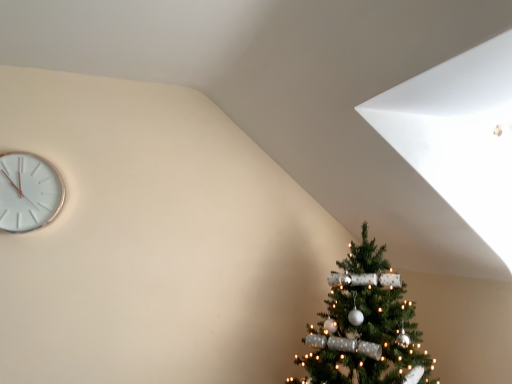
Question: Could you tell me if white metallic clock at upper left is turned towards green textured christmas tree at lower right?

Choices:
 (A) no
 (B) yes

Answer: (A)

Question: From the image's perspective, is white metallic clock at upper left under green textured christmas tree at lower right?

Choices:
 (A) yes
 (B) no

Answer: (B)

Question: Can you confirm if white metallic clock at upper left is positioned to the left of green textured christmas tree at lower right?

Choices:
 (A) no
 (B) yes

Answer: (B)

Question: Is white metallic clock at upper left beside green textured christmas tree at lower right?

Choices:
 (A) yes
 (B) no

Answer: (B)

Question: Is white metallic clock at upper left completely or partially outside of green textured christmas tree at lower right?

Choices:
 (A) no
 (B) yes

Answer: (B)

Question: Would you say white metallic clock at upper left contains green textured christmas tree at lower right?

Choices:
 (A) yes
 (B) no

Answer: (B)

Question: From the image's perspective, is green textured christmas tree at lower right beneath white metallic clock at upper left?

Choices:
 (A) no
 (B) yes

Answer: (B)

Question: Could you tell me if green textured christmas tree at lower right is facing white metallic clock at upper left?

Choices:
 (A) no
 (B) yes

Answer: (A)

Question: Is green textured christmas tree at lower right facing away from white metallic clock at upper left?

Choices:
 (A) yes
 (B) no

Answer: (B)

Question: Considering the relative sizes of green textured christmas tree at lower right and white metallic clock at upper left in the image provided, is green textured christmas tree at lower right bigger than white metallic clock at upper left?

Choices:
 (A) no
 (B) yes

Answer: (B)

Question: Can you confirm if green textured christmas tree at lower right is taller than white metallic clock at upper left?

Choices:
 (A) yes
 (B) no

Answer: (A)

Question: Does green textured christmas tree at lower right come in front of white metallic clock at upper left?

Choices:
 (A) yes
 (B) no

Answer: (A)

Question: Considering the relative positions of white metallic clock at upper left and green textured christmas tree at lower right in the image provided, is white metallic clock at upper left to the left or to the right of green textured christmas tree at lower right?

Choices:
 (A) left
 (B) right

Answer: (A)